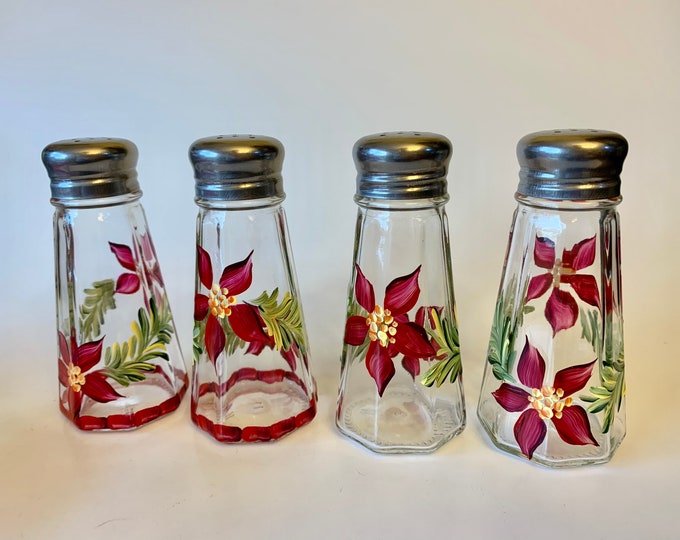
Where is `salt shaker 4`? Image resolution: width=680 pixels, height=540 pixels. salt shaker 4 is located at coordinates (523, 352).